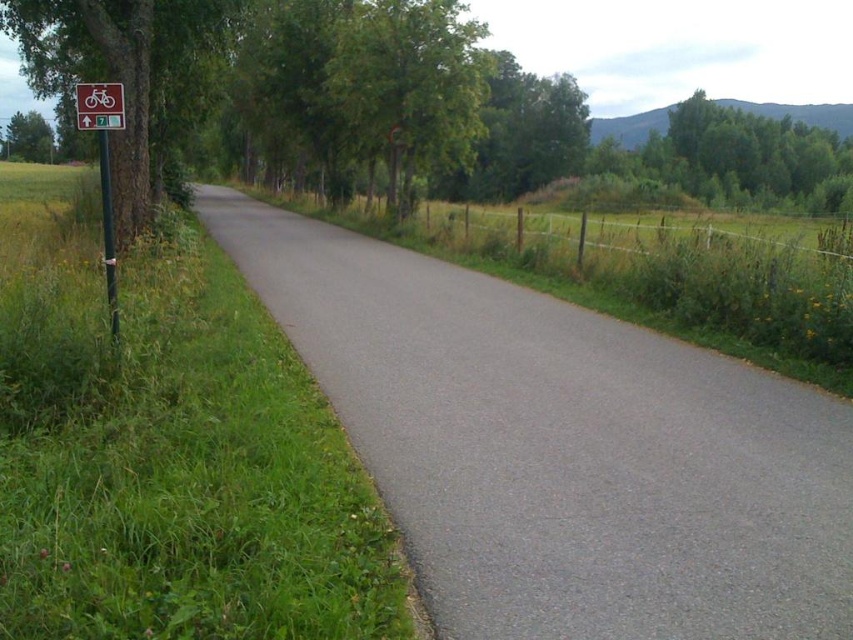
Looking at this image, you are a cyclist planning to follow the numbered trail indicated by the signpost with a red rectangular sign displaying a bicycle symbol. According to the image, where is the gray asphalt road at center in relation to the signpost?

The gray asphalt road at center is located at point (560,448), which is the coordinate position in the image. This places the road centrally in the scene, aligned with the signpost indicating the cycling route.

You are a cyclist approaching the road and see the red plastic sign at left and the white plastic bicycle sign at upper left. Which sign is closer to you as you approach the road?

The red plastic sign at left is closer to you because the white plastic bicycle sign at upper left is behind it.

You are a cyclist approaching the signpost on the left side of the road. You notice the green leafy tree at left and the green metallic pole at left. Which object is closer to the road?

The green metallic pole at left is closer to the road because the green leafy tree at left is to the left of it, meaning the tree is further away from the road compared to the pole.